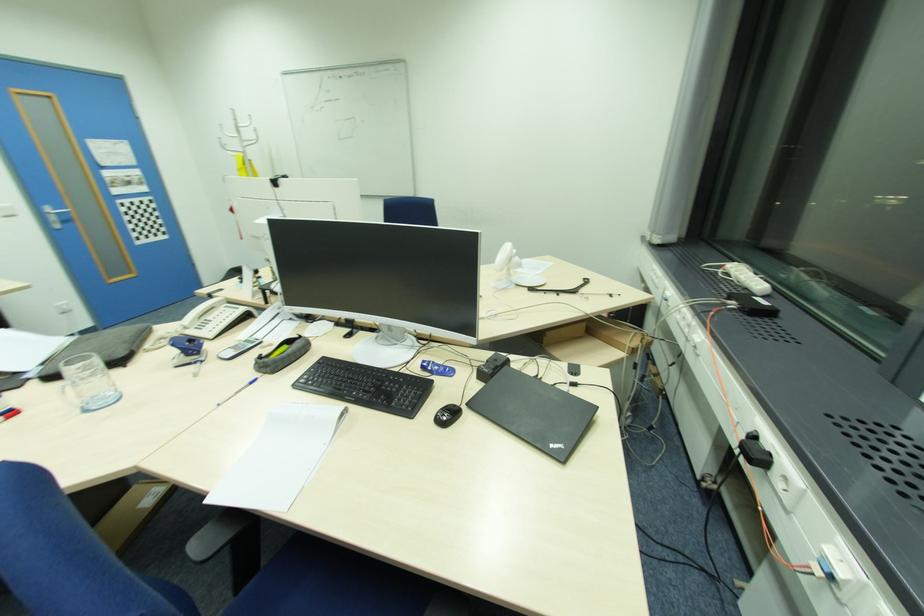
What do you see at coordinates (318, 589) in the screenshot?
I see `a chair sitting surface` at bounding box center [318, 589].